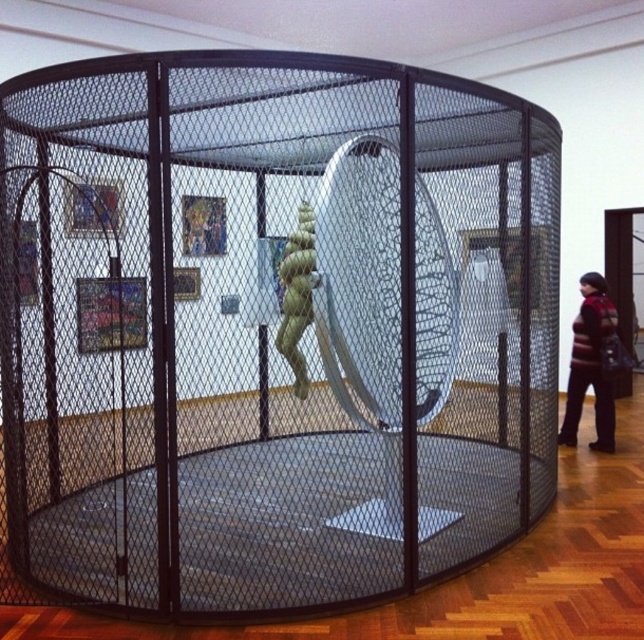
Question: Can you confirm if striped sweater at right is bigger than green matte sculpture at center?

Choices:
 (A) yes
 (B) no

Answer: (A)

Question: Which point is closer to the camera taking this photo?

Choices:
 (A) (290, 269)
 (B) (578, 362)

Answer: (A)

Question: Can you confirm if striped sweater at right is wider than green matte sculpture at center?

Choices:
 (A) yes
 (B) no

Answer: (A)

Question: Does striped sweater at right have a greater width compared to green matte sculpture at center?

Choices:
 (A) no
 (B) yes

Answer: (B)